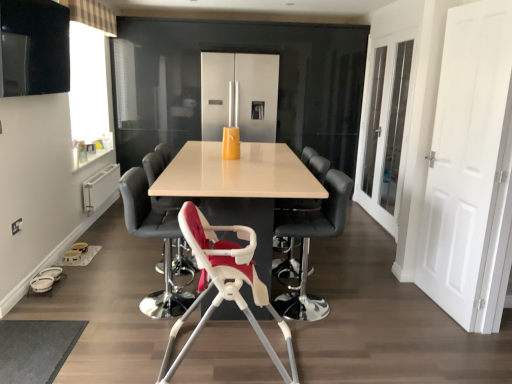
Question: Considering the relative sizes of black leather bar stool at center, which is the 3th chair from back to front, and white matte door at right in the image provided, is black leather bar stool at center, which is the 3th chair from back to front, bigger than white matte door at right?

Choices:
 (A) yes
 (B) no

Answer: (A)

Question: Can you confirm if black leather bar stool at center, which is the 3th chair from back to front, is smaller than white matte door at right?

Choices:
 (A) yes
 (B) no

Answer: (B)

Question: From the image's perspective, would you say black leather bar stool at center, which is the 3th chair from back to front, is positioned over white matte door at right?

Choices:
 (A) no
 (B) yes

Answer: (A)

Question: Is white matte door at right at the back of black leather bar stool at center, placed as the third chair when sorted from front to back?

Choices:
 (A) yes
 (B) no

Answer: (A)

Question: Does black leather bar stool at center, placed as the third chair when sorted from front to back, have a lesser height compared to white matte door at right?

Choices:
 (A) yes
 (B) no

Answer: (A)

Question: Considering the relative positions of matte white table at center and black leather chair at center, the 5th chair in the front-to-back sequence, in the image provided, is matte white table at center to the left or to the right of black leather chair at center, the 5th chair in the front-to-back sequence,?

Choices:
 (A) left
 (B) right

Answer: (A)

Question: Is matte white table at center inside or outside of black leather chair at center, the 5th chair in the front-to-back sequence?

Choices:
 (A) outside
 (B) inside

Answer: (A)

Question: In the image, is matte white table at center positioned in front of or behind black leather chair at center, the first chair when ordered from back to front?

Choices:
 (A) front
 (B) behind

Answer: (A)

Question: From a real-world perspective, is matte white table at center positioned above or below black leather chair at center, the 5th chair in the front-to-back sequence?

Choices:
 (A) above
 (B) below

Answer: (B)

Question: From a real-world perspective, is white plastic highchair at center, the fifth chair when ordered from back to front, above or below matte black chair at center, acting as the second chair starting from the back?

Choices:
 (A) below
 (B) above

Answer: (A)

Question: From their relative heights in the image, would you say white plastic highchair at center, the fifth chair when ordered from back to front, is taller or shorter than matte black chair at center, which appears as the fourth chair when viewed from the front?

Choices:
 (A) short
 (B) tall

Answer: (A)

Question: Looking at their shapes, would you say white plastic highchair at center, placed as the first chair when sorted from front to back, is wider or thinner than matte black chair at center, which appears as the fourth chair when viewed from the front?

Choices:
 (A) thin
 (B) wide

Answer: (B)

Question: Would you say white plastic highchair at center, the fifth chair when ordered from back to front, is inside or outside matte black chair at center, acting as the second chair starting from the back?

Choices:
 (A) inside
 (B) outside

Answer: (B)

Question: Is point (315, 198) closer or farther from the camera than point (394, 195)?

Choices:
 (A) closer
 (B) farther

Answer: (A)

Question: From a real-world perspective, is black leather chair at center, the first chair when ordered from back to front, positioned above or below white glass door at right?

Choices:
 (A) above
 (B) below

Answer: (B)